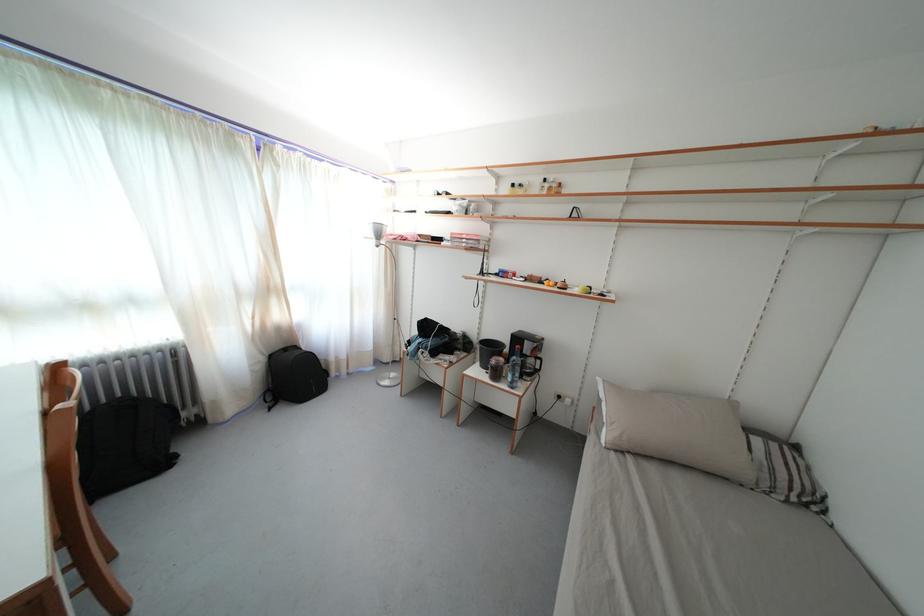
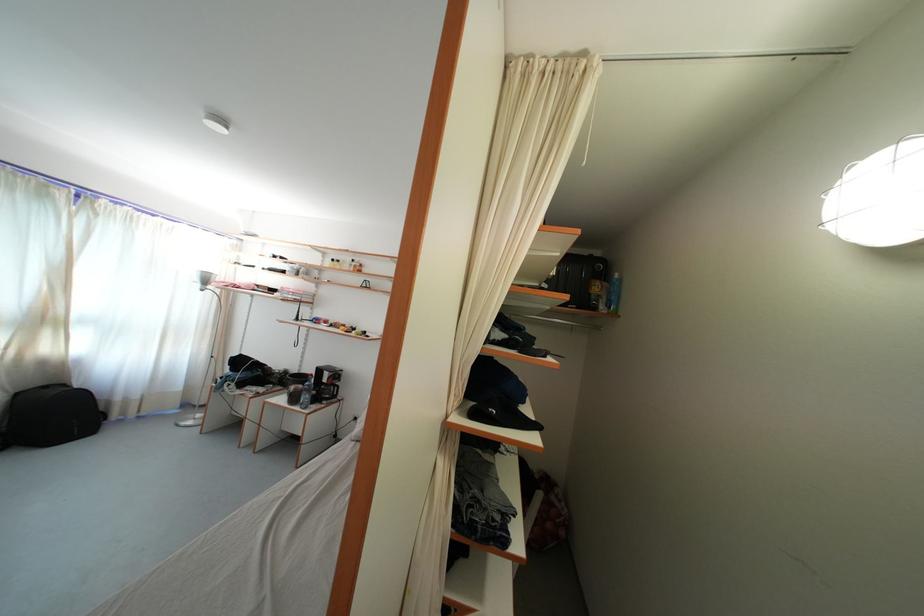
The point at (276, 362) is marked in the first image. Where is the corresponding point in the second image?

(23, 400)